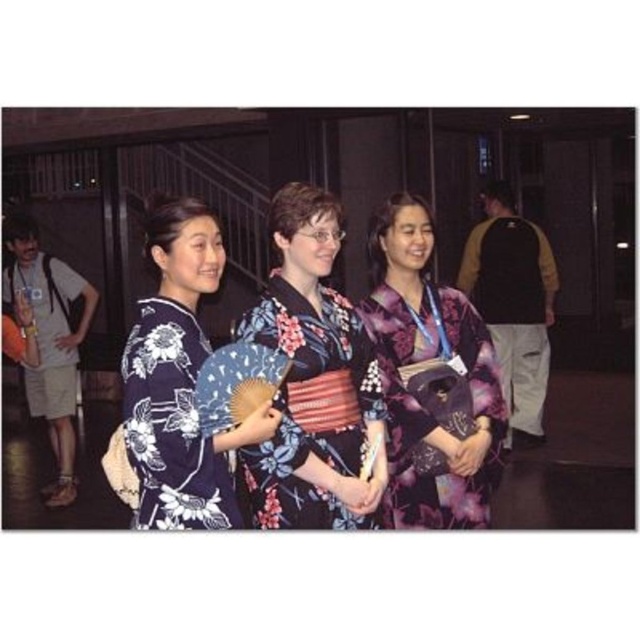
Question: Which point is farther to the camera?

Choices:
 (A) purple floral kimono at center
 (B) dark blue floral kimono at center

Answer: (A)

Question: Which object is the closest to the dark blue floral kimono at center?

Choices:
 (A) purple floral kimono at center
 (B) floral silk kimono at left
 (C) floral silk kimono at center

Answer: (C)

Question: Can you confirm if dark blue floral kimono at center is thinner than floral silk kimono at left?

Choices:
 (A) no
 (B) yes

Answer: (B)

Question: Is the position of purple floral kimono at center more distant than that of floral silk kimono at left?

Choices:
 (A) yes
 (B) no

Answer: (B)

Question: Is purple floral kimono at center wider than floral silk kimono at left?

Choices:
 (A) no
 (B) yes

Answer: (A)

Question: Which of the following is the closest to the observer?

Choices:
 (A) floral silk kimono at left
 (B) floral silk kimono at center

Answer: (B)